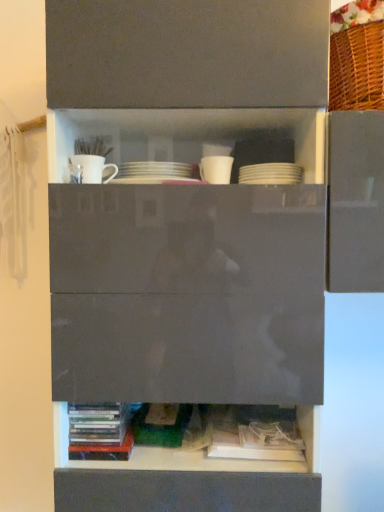
Where is `vacant region above white paper book at lower center, the first book viewed from the right (from a real-world perspective)`? vacant region above white paper book at lower center, the first book viewed from the right (from a real-world perspective) is located at coordinates (251, 419).